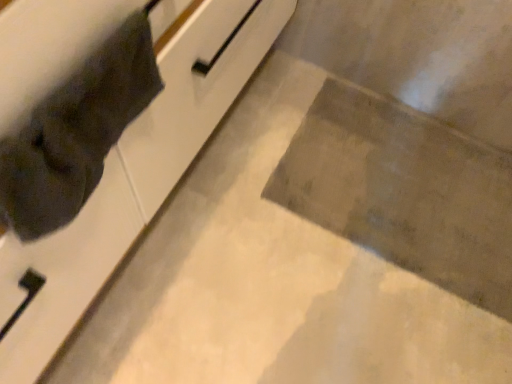
Question: Considering the relative positions of dark fabric cat at left and white glossy cabinet at upper left in the image provided, is dark fabric cat at left to the left of white glossy cabinet at upper left from the viewer's perspective?

Choices:
 (A) yes
 (B) no

Answer: (B)

Question: From the image's perspective, is dark fabric cat at left beneath white glossy cabinet at upper left?

Choices:
 (A) yes
 (B) no

Answer: (A)

Question: Can you confirm if dark fabric cat at left is bigger than white glossy cabinet at upper left?

Choices:
 (A) yes
 (B) no

Answer: (B)

Question: Considering the relative sizes of dark fabric cat at left and white glossy cabinet at upper left in the image provided, is dark fabric cat at left smaller than white glossy cabinet at upper left?

Choices:
 (A) yes
 (B) no

Answer: (A)

Question: From a real-world perspective, is dark fabric cat at left located higher than white glossy cabinet at upper left?

Choices:
 (A) no
 (B) yes

Answer: (B)

Question: Can we say dark fabric cat at left lies outside white glossy cabinet at upper left?

Choices:
 (A) no
 (B) yes

Answer: (A)

Question: From a real-world perspective, is white glossy cabinet at upper left physically below dark fabric cat at left?

Choices:
 (A) yes
 (B) no

Answer: (A)

Question: Would you say dark fabric cat at left is part of white glossy cabinet at upper left's contents?

Choices:
 (A) yes
 (B) no

Answer: (A)

Question: Can you confirm if white glossy cabinet at upper left is positioned to the left of dark fabric cat at left?

Choices:
 (A) yes
 (B) no

Answer: (A)

Question: Considering the relative sizes of white glossy cabinet at upper left and dark fabric cat at left in the image provided, is white glossy cabinet at upper left shorter than dark fabric cat at left?

Choices:
 (A) yes
 (B) no

Answer: (B)

Question: Considering the relative positions of white glossy cabinet at upper left and dark fabric cat at left in the image provided, is white glossy cabinet at upper left to the right of dark fabric cat at left from the viewer's perspective?

Choices:
 (A) no
 (B) yes

Answer: (A)

Question: From the image's perspective, is white glossy cabinet at upper left beneath dark fabric cat at left?

Choices:
 (A) yes
 (B) no

Answer: (B)

Question: In terms of width, does dark fabric cat at left look wider or thinner when compared to white glossy cabinet at upper left?

Choices:
 (A) thin
 (B) wide

Answer: (A)